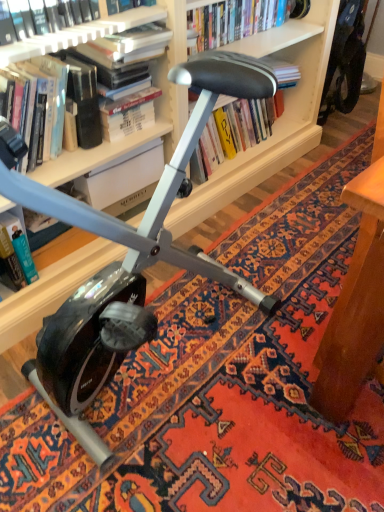
Question: Is hardcover book at upper center, which appears as the second book when viewed from the right, taller or shorter than hardcover book at upper left, which is the 3th book from right to left?

Choices:
 (A) short
 (B) tall

Answer: (B)

Question: From the image's perspective, is hardcover book at upper center, the 3th book when ordered from left to right, located above or below hardcover book at upper left, the second book when ordered from left to right?

Choices:
 (A) above
 (B) below

Answer: (A)

Question: Which of these objects is positioned farthest from the hardcover book at left, the first book positioned from the left?

Choices:
 (A) matte white bookcase at upper center
 (B) hardcover book at upper center, the 3th book when ordered from left to right
 (C) hardcover book at upper left, the second book when ordered from left to right
 (D) hardcover book at center, positioned as the 1th book in right-to-left order
 (E) hardcover book at center

Answer: (D)

Question: Considering the real-world distances, which object is closest to the matte white bookcase at upper center?

Choices:
 (A) hardcover book at center
 (B) hardcover book at left, which is counted as the 4th book, starting from the right
 (C) hardcover book at center, which appears as the fourth book when viewed from the left
 (D) hardcover book at upper center, the 3th book when ordered from left to right
 (E) hardcover book at upper left, which is the 3th book from right to left

Answer: (C)